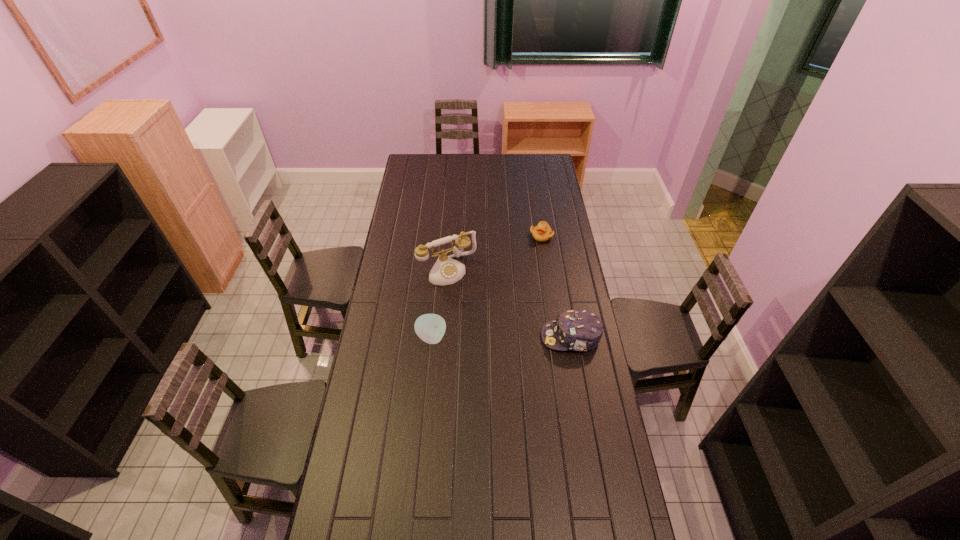
You are a GUI agent. You are given a task and a screenshot of the screen. Output one action in this format:
    pyautogui.click(x=<x>, y=<y>)
    Task: Click on the free space located on the front-facing side of the duckling
    This screenshot has width=960, height=540.
    Given the screenshot: What is the action you would take?
    [533, 274]

Identify the location of vacant region located on the front-facing side of the duckling. (529, 294).

The width and height of the screenshot is (960, 540). What are the coordinates of `free space located on the front-facing side of the duckling` in the screenshot? It's located at (537, 259).

Locate an element on the screen. The width and height of the screenshot is (960, 540). free location located on the dial of the third nearest object is located at coordinates (496, 343).

Find the location of a particular element. Image resolution: width=960 pixels, height=540 pixels. free space located on the dial of the third nearest object is located at coordinates (472, 305).

Locate an element on the screen. Image resolution: width=960 pixels, height=540 pixels. free region located on the dial of the third nearest object is located at coordinates (468, 297).

At what (x,y) coordinates should I click in order to perform the action: click on headwear present at the right edge. Please return your answer as a coordinate pair (x, y). Looking at the image, I should click on (578, 330).

This screenshot has height=540, width=960. Identify the location of duckling that is at the right edge. (542, 232).

What are the coordinates of `vacant space at the far edge` in the screenshot? It's located at pos(529,170).

At what (x,y) coordinates should I click in order to perform the action: click on vacant region at the near edge of the desktop. Please return your answer as a coordinate pair (x, y). Looking at the image, I should click on (461, 525).